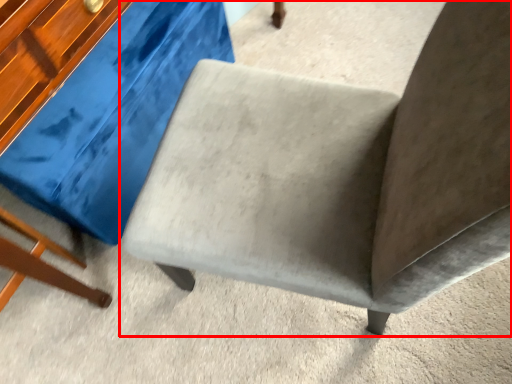
Question: From the image's perspective, what is the correct spatial positioning of chair (annotated by the red box) in reference to swivel chair?

Choices:
 (A) below
 (B) above

Answer: (A)